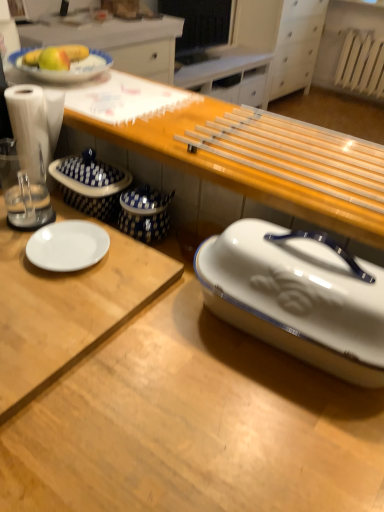
Question: Does wooden table at center have a larger size compared to white glossy desk at center, the 2th desk in the top-to-bottom sequence?

Choices:
 (A) yes
 (B) no

Answer: (B)

Question: From the image's perspective, would you say wooden table at center is positioned over white glossy desk at center, the 2th desk in the top-to-bottom sequence?

Choices:
 (A) yes
 (B) no

Answer: (A)

Question: Considering the relative positions of wooden table at center and white glossy desk at center, which is counted as the first desk, starting from the bottom, in the image provided, is wooden table at center behind white glossy desk at center, which is counted as the first desk, starting from the bottom,?

Choices:
 (A) yes
 (B) no

Answer: (A)

Question: Is wooden table at center oriented away from white glossy desk at center, which is counted as the first desk, starting from the bottom?

Choices:
 (A) no
 (B) yes

Answer: (A)

Question: Can you confirm if wooden table at center is taller than white glossy desk at center, which is counted as the first desk, starting from the bottom?

Choices:
 (A) no
 (B) yes

Answer: (A)

Question: Can you confirm if wooden table at center is wider than white glossy desk at center, the 2th desk in the top-to-bottom sequence?

Choices:
 (A) no
 (B) yes

Answer: (A)

Question: Can you confirm if white glossy desk at center, the 2th desk in the top-to-bottom sequence, is smaller than white glossy plate at left, the 1th desk positioned from the top?

Choices:
 (A) no
 (B) yes

Answer: (A)

Question: From a real-world perspective, is white glossy desk at center, which is counted as the first desk, starting from the bottom, positioned under white glossy plate at left, which is the 2th desk from bottom to top, based on gravity?

Choices:
 (A) yes
 (B) no

Answer: (A)

Question: Considering the relative positions of white glossy desk at center, the 2th desk in the top-to-bottom sequence, and white glossy plate at left, which is the 2th desk from bottom to top, in the image provided, is white glossy desk at center, the 2th desk in the top-to-bottom sequence, to the left of white glossy plate at left, which is the 2th desk from bottom to top, from the viewer's perspective?

Choices:
 (A) yes
 (B) no

Answer: (B)

Question: Is white glossy plate at left, which is the 2th desk from bottom to top, surrounded by white glossy desk at center, the 2th desk in the top-to-bottom sequence?

Choices:
 (A) yes
 (B) no

Answer: (A)

Question: From the image's perspective, is white glossy desk at center, which is counted as the first desk, starting from the bottom, on top of white glossy plate at left, the 1th desk positioned from the top?

Choices:
 (A) yes
 (B) no

Answer: (B)

Question: Is there a large distance between white glossy desk at center, the 2th desk in the top-to-bottom sequence, and white glossy plate at left, the 1th desk positioned from the top?

Choices:
 (A) no
 (B) yes

Answer: (A)

Question: Considering the relative sizes of yellow matte apple at upper left and transparent plastic blender at left in the image provided, is yellow matte apple at upper left thinner than transparent plastic blender at left?

Choices:
 (A) yes
 (B) no

Answer: (A)